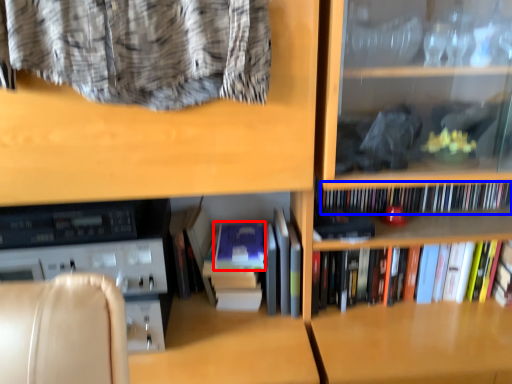
Question: Which object is further to the camera taking this photo, paperback book (highlighted by a red box) or book (highlighted by a blue box)?

Choices:
 (A) paperback book
 (B) book

Answer: (B)